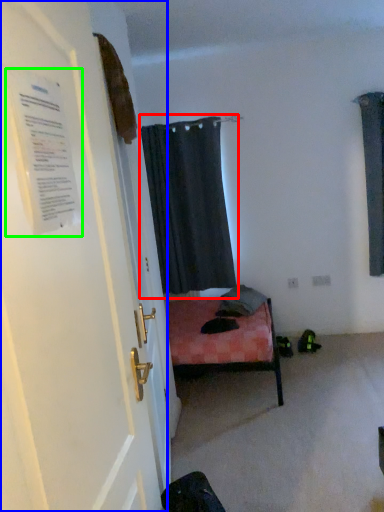
Question: Considering the real-world distances, which object is closest to curtain (highlighted by a red box)? door (highlighted by a blue box) or poster (highlighted by a green box).

Choices:
 (A) door
 (B) poster

Answer: (A)